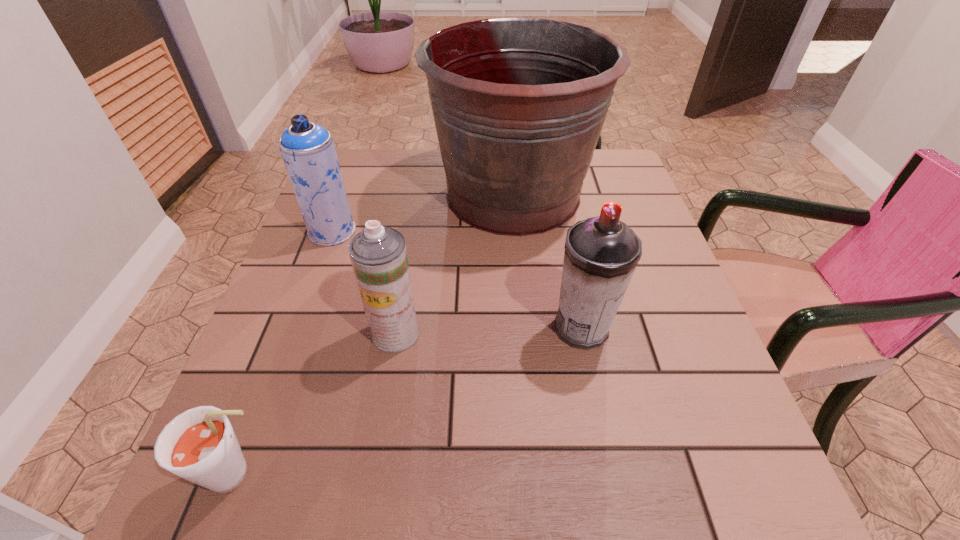
You are a GUI agent. You are given a task and a screenshot of the screen. Output one action in this format:
    pyautogui.click(x=<x>, y=<y>)
    Task: Click on the vacant space at the left edge
    
    Given the screenshot: What is the action you would take?
    pyautogui.click(x=315, y=352)

The height and width of the screenshot is (540, 960). Find the location of `free space at the right edge of the desktop`. free space at the right edge of the desktop is located at coordinates (625, 326).

The width and height of the screenshot is (960, 540). In the image, there is a desktop. What are the coordinates of `vacant space at the far left corner` in the screenshot? It's located at (380, 178).

Locate an element on the screen. The height and width of the screenshot is (540, 960). vacant point at the near right corner is located at coordinates 730,469.

You are a GUI agent. You are given a task and a screenshot of the screen. Output one action in this format:
    pyautogui.click(x=<x>, y=<y>)
    Task: Click on the vacant space in between the rightmost aerosol can and the bucket
    This screenshot has width=960, height=540.
    Given the screenshot: What is the action you would take?
    pyautogui.click(x=547, y=261)

Locate an element on the screen. The image size is (960, 540). free space between the leftmost aerosol can and the rightmost aerosol can is located at coordinates (457, 280).

At what (x,y) coordinates should I click in order to perform the action: click on free space between the shortest object and the second aerosol can from left to right. Please return your answer as a coordinate pair (x, y). Looking at the image, I should click on (317, 404).

You are a GUI agent. You are given a task and a screenshot of the screen. Output one action in this format:
    pyautogui.click(x=<x>, y=<y>)
    Task: Click on the unoccupied area between the bucket and the rightmost aerosol can
    The width and height of the screenshot is (960, 540).
    Given the screenshot: What is the action you would take?
    pyautogui.click(x=547, y=261)

The image size is (960, 540). Find the location of `free area in between the second aerosol can from left to right and the rightmost aerosol can`. free area in between the second aerosol can from left to right and the rightmost aerosol can is located at coordinates (489, 330).

Find the location of a particular element. This screenshot has height=540, width=960. free spot between the farthest aerosol can and the bucket is located at coordinates (422, 213).